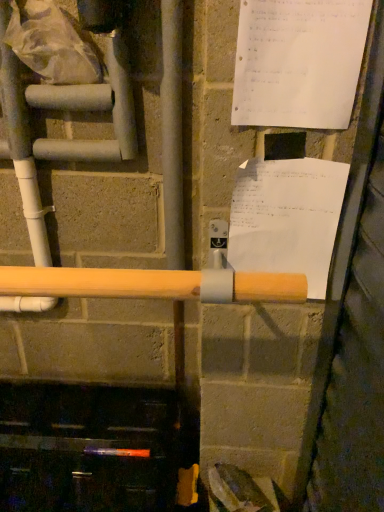
Question: Can you confirm if white paper at upper right, positioned as the first paper in bottom-to-top order, is wider than white plastic water pipe at left?

Choices:
 (A) yes
 (B) no

Answer: (B)

Question: Is white paper at upper right, the second paper when ordered from front to back, not inside white plastic water pipe at left?

Choices:
 (A) yes
 (B) no

Answer: (A)

Question: Does white paper at upper right, marked as the first paper in a back-to-front arrangement, have a larger size compared to white plastic water pipe at left?

Choices:
 (A) no
 (B) yes

Answer: (B)

Question: Considering the relative positions of white paper at upper right, acting as the 2th paper starting from the top, and white plastic water pipe at left in the image provided, is white paper at upper right, acting as the 2th paper starting from the top, in front of white plastic water pipe at left?

Choices:
 (A) yes
 (B) no

Answer: (A)

Question: From the image's perspective, does white paper at upper right, marked as the first paper in a back-to-front arrangement, appear lower than white plastic water pipe at left?

Choices:
 (A) yes
 (B) no

Answer: (A)

Question: Would you say translucent plastic bag at upper left is inside or outside white paper at upper right, acting as the 1th paper starting from the front?

Choices:
 (A) outside
 (B) inside

Answer: (A)

Question: Considering the relative positions of translucent plastic bag at upper left and white paper at upper right, acting as the 1th paper starting from the front, in the image provided, is translucent plastic bag at upper left to the left or to the right of white paper at upper right, acting as the 1th paper starting from the front,?

Choices:
 (A) left
 (B) right

Answer: (A)

Question: Is point (64, 48) closer or farther from the camera than point (297, 93)?

Choices:
 (A) farther
 (B) closer

Answer: (A)

Question: In terms of size, does translucent plastic bag at upper left appear bigger or smaller than white paper at upper right, marked as the 2th paper in a bottom-to-top arrangement?

Choices:
 (A) big
 (B) small

Answer: (A)

Question: From a real-world perspective, is white paper at upper right, the first paper when ordered from top to bottom, physically located above or below white paper at upper right, acting as the 2th paper starting from the top?

Choices:
 (A) above
 (B) below

Answer: (A)

Question: Is white paper at upper right, which is the second paper from back to front, in front of or behind white paper at upper right, acting as the 2th paper starting from the top, in the image?

Choices:
 (A) front
 (B) behind

Answer: (A)

Question: Considering the positions of point click(x=309, y=53) and point click(x=299, y=266), is point click(x=309, y=53) closer or farther from the camera than point click(x=299, y=266)?

Choices:
 (A) farther
 (B) closer

Answer: (B)

Question: In terms of width, does white paper at upper right, marked as the 2th paper in a bottom-to-top arrangement, look wider or thinner when compared to white paper at upper right, the second paper when ordered from front to back?

Choices:
 (A) wide
 (B) thin

Answer: (B)

Question: Looking at their shapes, would you say translucent plastic bag at upper left is wider or thinner than white plastic water pipe at left?

Choices:
 (A) wide
 (B) thin

Answer: (A)

Question: Considering the positions of point (26, 24) and point (39, 244), is point (26, 24) closer or farther from the camera than point (39, 244)?

Choices:
 (A) closer
 (B) farther

Answer: (A)